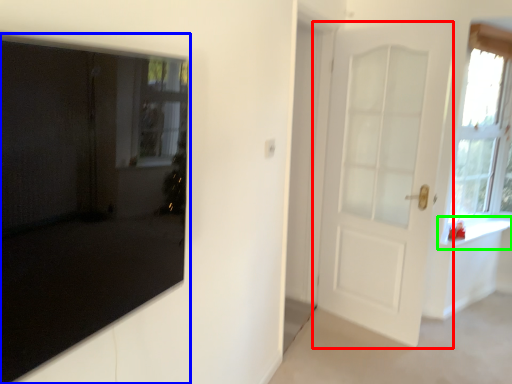
Question: Estimate the real-world distances between objects in this image. Which object is closer to door (highlighted by a red box), door (highlighted by a blue box) or window sill (highlighted by a green box)?

Choices:
 (A) door
 (B) window sill

Answer: (B)